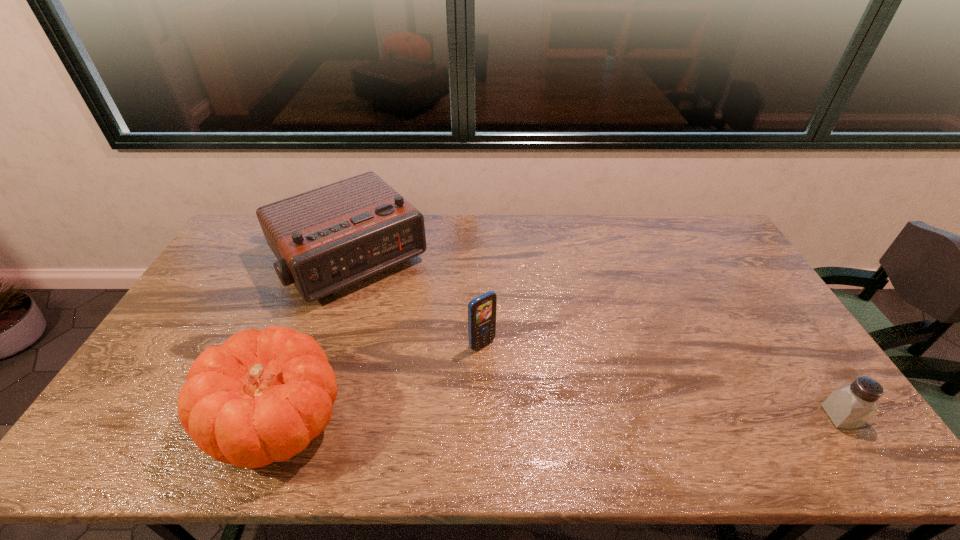
Locate an element on the screen. free region located 0.160m on the screen of the cellular telephone is located at coordinates (527, 391).

This screenshot has height=540, width=960. Identify the location of blank space located on the front panel of the farthest object. (424, 346).

Identify the location of free space located 0.230m on the front panel of the farthest object. Image resolution: width=960 pixels, height=540 pixels. (426, 348).

Image resolution: width=960 pixels, height=540 pixels. Identify the location of blank space located on the front panel of the farthest object. (432, 354).

At what (x,y) coordinates should I click in order to perform the action: click on object at the far edge. Please return your answer as a coordinate pair (x, y). Looking at the image, I should click on (326, 239).

Locate an element on the screen. pumpkin that is at the near edge is located at coordinates (262, 397).

Image resolution: width=960 pixels, height=540 pixels. What are the coordinates of `saltshaker located at the near edge` in the screenshot? It's located at (850, 406).

Find the location of a particular element. object at the right edge is located at coordinates (850, 406).

What are the coordinates of `object present at the near right corner` in the screenshot? It's located at (x=850, y=406).

Locate an element on the screen. The height and width of the screenshot is (540, 960). vacant space at the far edge of the desktop is located at coordinates (688, 253).